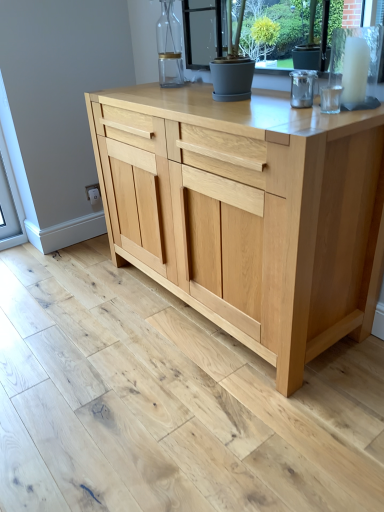
Locate an element on the screen. vacant area that is in front of natural wood cabinet at center is located at coordinates (202, 412).